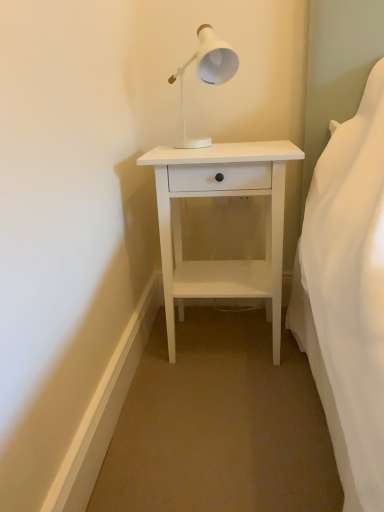
Question: Is white matte nightstand at center spatially inside white matte lamp at upper center, or outside of it?

Choices:
 (A) outside
 (B) inside

Answer: (A)

Question: From the image's perspective, relative to white matte lamp at upper center, is white matte nightstand at center above or below?

Choices:
 (A) above
 (B) below

Answer: (B)

Question: In terms of width, does white matte nightstand at center look wider or thinner when compared to white matte lamp at upper center?

Choices:
 (A) wide
 (B) thin

Answer: (A)

Question: Is white matte lamp at upper center to the left or to the right of white matte nightstand at center in the image?

Choices:
 (A) left
 (B) right

Answer: (A)

Question: Is white matte lamp at upper center wider or thinner than white matte nightstand at center?

Choices:
 (A) thin
 (B) wide

Answer: (A)

Question: Is point (220, 42) positioned closer to the camera than point (196, 281)?

Choices:
 (A) farther
 (B) closer

Answer: (B)

Question: From the image's perspective, is white matte lamp at upper center above or below white matte nightstand at center?

Choices:
 (A) below
 (B) above

Answer: (B)